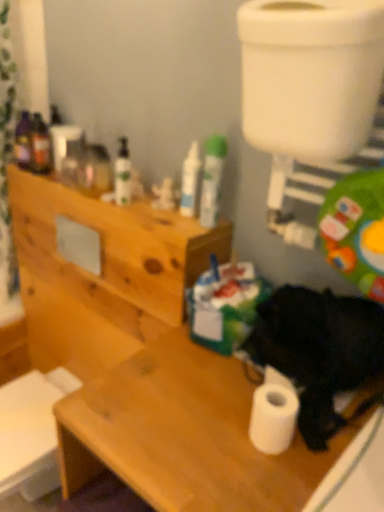
Where is `free space in front of matte green bottle at upper center, which appears as the 1th toiletry when viewed from the left`? free space in front of matte green bottle at upper center, which appears as the 1th toiletry when viewed from the left is located at coordinates (140, 212).